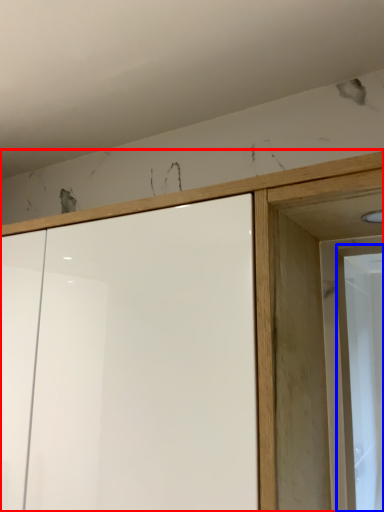
Question: Which object is closer to the camera taking this photo, cupboard (highlighted by a red box) or screen door (highlighted by a blue box)?

Choices:
 (A) cupboard
 (B) screen door

Answer: (A)